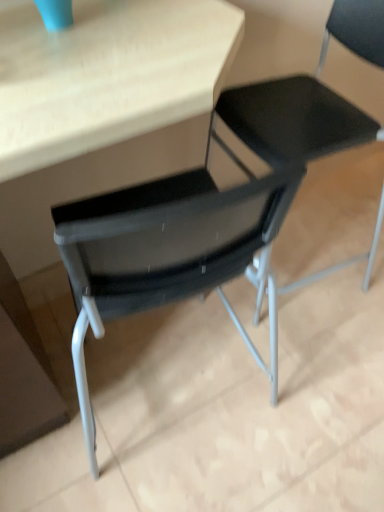
Question: Is point (230, 262) closer or farther from the camera than point (195, 2)?

Choices:
 (A) closer
 (B) farther

Answer: (A)

Question: Is black mesh chair at center, placed as the first chair when sorted from right to left, inside or outside of matte wood table at center?

Choices:
 (A) outside
 (B) inside

Answer: (A)

Question: Considering the real-world distances, which object is closest to the black mesh chair at center, the first chair in the left-to-right sequence?

Choices:
 (A) matte wood table at center
 (B) black mesh chair at center, acting as the 2th chair starting from the left

Answer: (A)

Question: Estimate the real-world distances between objects in this image. Which object is closer to the black mesh chair at center, placed as the first chair when sorted from right to left?

Choices:
 (A) matte wood table at center
 (B) black mesh chair at center, the second chair in the right-to-left sequence

Answer: (A)